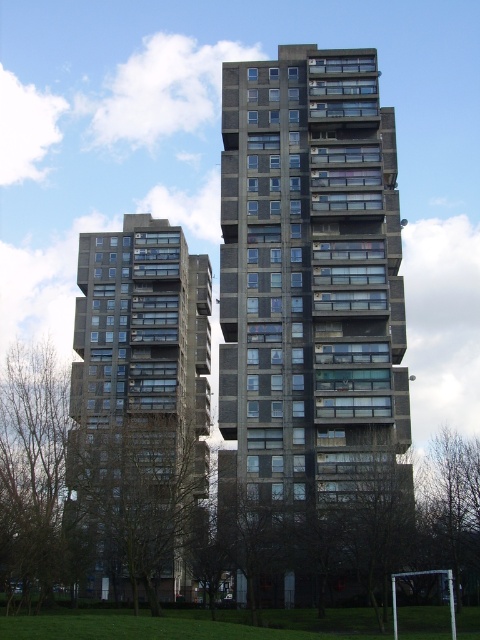
You are a city planner assessing the skyline of this area. You need to determine which building, the concrete block building at center or the dark gray concrete building at left, would cast a longer shadow at noon. Based on their heights, which one would cast a longer shadow?

The concrete block building at center is taller than the dark gray concrete building at left, so it would cast a longer shadow at noon.

You are standing in front of two tall residential high rise buildings. You notice two points marked on the buildings. The first point is at coordinate point (383, 385) and the second point is at coordinate point (170, 280). Which point is closer to you?

Point (383, 385) is closer to the camera than point (170, 280).

You are standing at the origin point of the coordinate system in the image. You want to move towards the concrete block building at center. Which direction should you move in terms of x and y coordinates?

The concrete block building at center is located at coordinates point (310, 276). Since the origin is at the bottom left corner, you should move to the right in the x direction and upwards in the y direction to reach it.